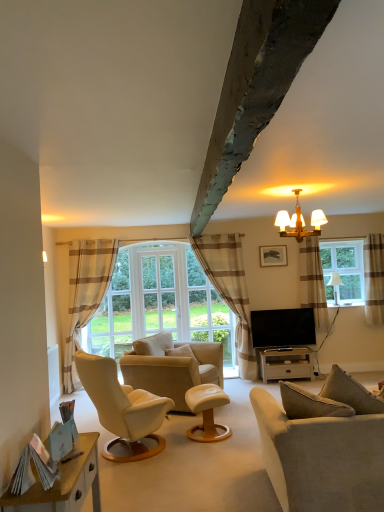
Question: Considering the relative positions of beige leather armchair at center and wooden desk at lower left in the image provided, is beige leather armchair at center to the left of wooden desk at lower left from the viewer's perspective?

Choices:
 (A) no
 (B) yes

Answer: (A)

Question: Does beige leather armchair at center have a smaller size compared to wooden desk at lower left?

Choices:
 (A) yes
 (B) no

Answer: (B)

Question: Could you tell me if beige leather armchair at center is facing wooden desk at lower left?

Choices:
 (A) yes
 (B) no

Answer: (B)

Question: Considering the relative sizes of beige leather armchair at center and wooden desk at lower left in the image provided, is beige leather armchair at center bigger than wooden desk at lower left?

Choices:
 (A) yes
 (B) no

Answer: (A)

Question: Would you say beige leather armchair at center is outside wooden desk at lower left?

Choices:
 (A) yes
 (B) no

Answer: (A)

Question: Is beige leather armchair at center positioned in front of wooden desk at lower left?

Choices:
 (A) yes
 (B) no

Answer: (B)

Question: Is flat screen tv at center turned away from white leather stool at center?

Choices:
 (A) no
 (B) yes

Answer: (A)

Question: Is flat screen tv at center wider than white leather stool at center?

Choices:
 (A) no
 (B) yes

Answer: (A)

Question: Can we say flat screen tv at center lies outside white leather stool at center?

Choices:
 (A) no
 (B) yes

Answer: (B)

Question: Can you confirm if flat screen tv at center is smaller than white leather stool at center?

Choices:
 (A) yes
 (B) no

Answer: (A)

Question: Does flat screen tv at center have a greater height compared to white leather stool at center?

Choices:
 (A) yes
 (B) no

Answer: (A)

Question: Would you say white leather stool at center is part of flat screen tv at center's contents?

Choices:
 (A) yes
 (B) no

Answer: (B)

Question: Is beige striped curtain at left, arranged as the 1th curtain when viewed from the left, closer to camera compared to beige leather armchair at center?

Choices:
 (A) no
 (B) yes

Answer: (A)